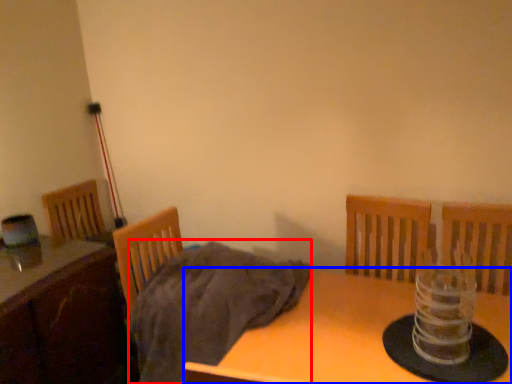
Question: Which of the following is the closest to the observer, blanket (highlighted by a red box) or table (highlighted by a blue box)?

Choices:
 (A) blanket
 (B) table

Answer: (B)